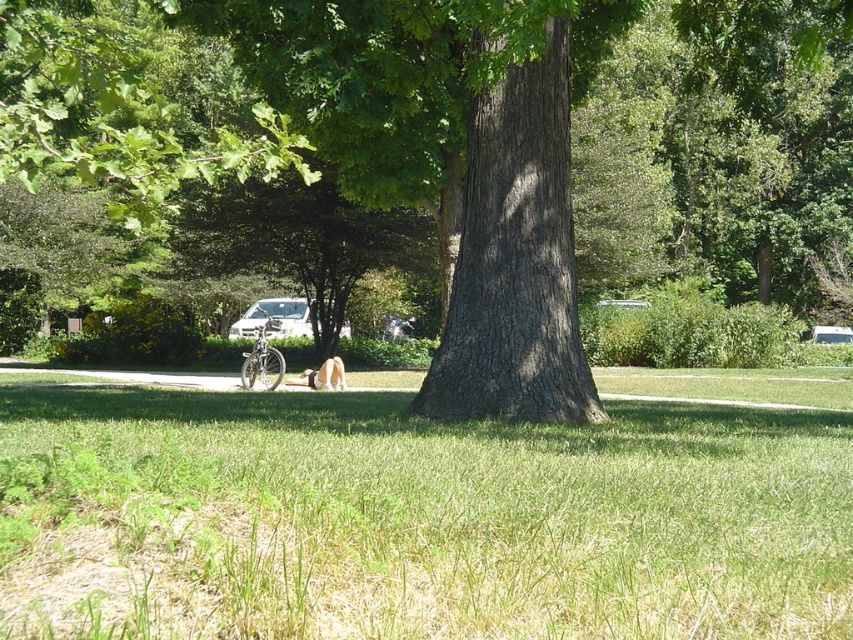
Does green grass at center appear over light brown fur at center?

No, green grass at center is not above light brown fur at center.

Which is above, green grass at center or light brown fur at center?

light brown fur at center is above.

Find the location of a particular element. The height and width of the screenshot is (640, 853). green grass at center is located at coordinates (415, 518).

Identify the location of green grass at center. The height and width of the screenshot is (640, 853). (415, 518).

Based on the photo, which is above, green grass at center or white matte car at center?

white matte car at center is higher up.

I want to click on green grass at center, so click(415, 518).

Who is higher up, white matte car at center or light brown fur at center?

white matte car at center is above.

From the picture: Can you confirm if white matte car at center is positioned above light brown fur at center?

Indeed, white matte car at center is positioned over light brown fur at center.

Image resolution: width=853 pixels, height=640 pixels. What are the coordinates of `white matte car at center` in the screenshot? It's located at (274, 317).